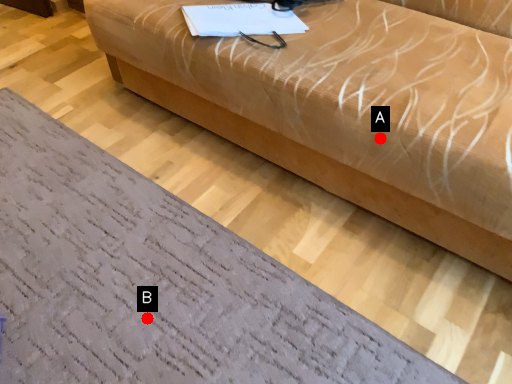
Question: Two points are circled on the image, labeled by A and B beside each circle. Which of the following is the closest to the observer?

Choices:
 (A) A is closer
 (B) B is closer

Answer: (A)